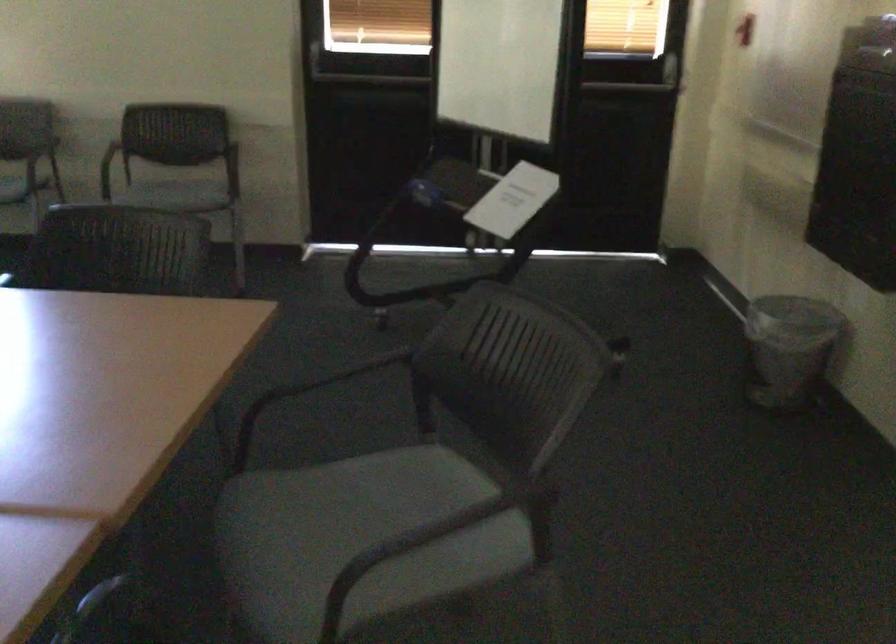
This screenshot has height=644, width=896. I want to click on white paper sign, so click(x=513, y=200).